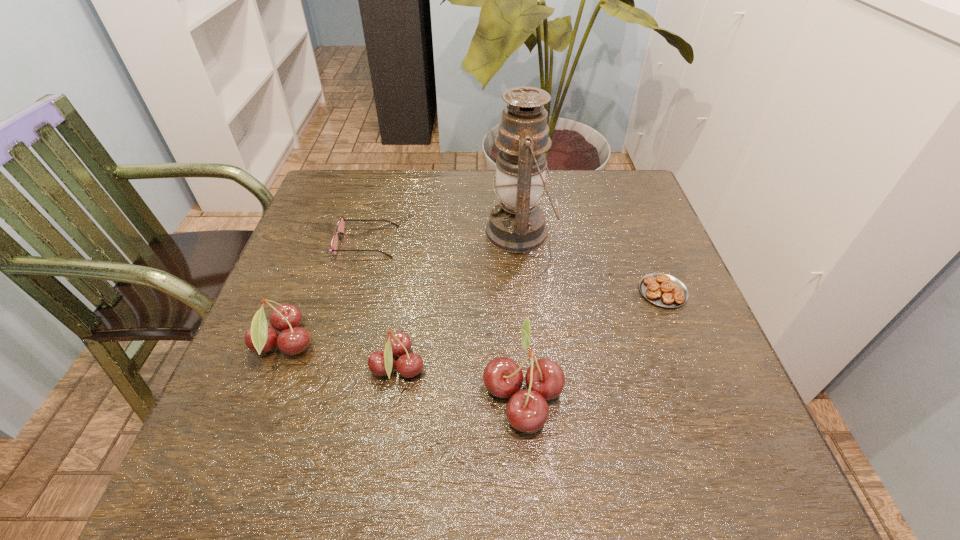
I want to click on object situated at the right edge, so click(x=664, y=290).

Where is `free space at the far edge of the desktop`? The width and height of the screenshot is (960, 540). free space at the far edge of the desktop is located at coordinates (462, 178).

Where is `free space at the near edge of the desktop`? This screenshot has width=960, height=540. free space at the near edge of the desktop is located at coordinates (602, 384).

This screenshot has width=960, height=540. What are the coordinates of `vacant space at the left edge` in the screenshot? It's located at (295, 287).

Locate an element on the screen. This screenshot has height=540, width=960. free space at the right edge of the desktop is located at coordinates (643, 222).

Locate an element on the screen. The height and width of the screenshot is (540, 960). vacant space at the far left corner of the desktop is located at coordinates (346, 193).

In the image, there is a desktop. Identify the location of free space at the near left corner. The width and height of the screenshot is (960, 540). (287, 406).

Locate an element on the screen. This screenshot has width=960, height=540. free space at the far right corner of the desktop is located at coordinates (622, 212).

I want to click on free spot at the near right corner of the desktop, so click(x=673, y=418).

Where is `empty location between the tallest object and the second tallest cherry`? The width and height of the screenshot is (960, 540). empty location between the tallest object and the second tallest cherry is located at coordinates (402, 288).